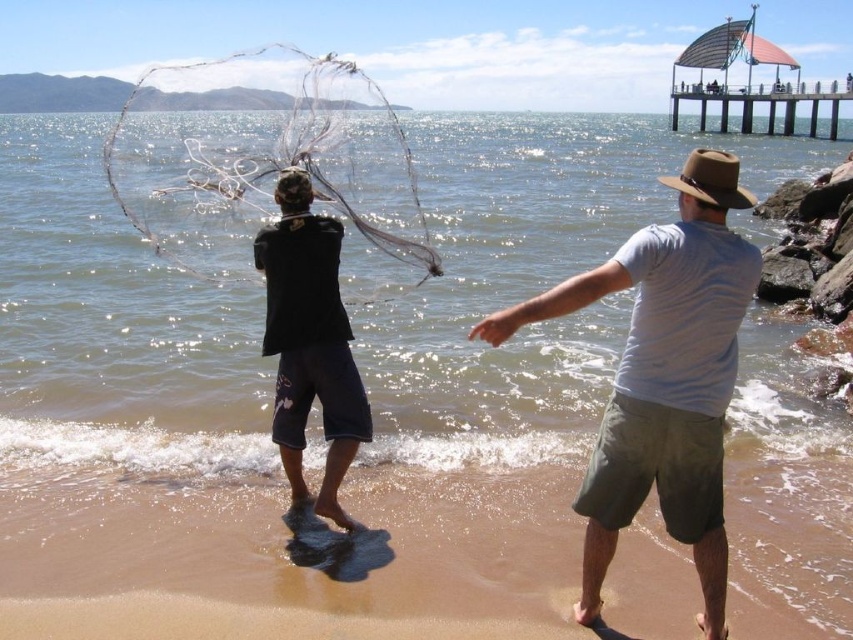
Question: Among these points, which one is farthest from the camera?

Choices:
 (A) (189, 192)
 (B) (287, 472)
 (C) (738, 163)

Answer: (A)

Question: Which of the following is the farthest from the observer?

Choices:
 (A) (32, 524)
 (B) (280, 380)

Answer: (B)

Question: Which is nearer to the wooden pier at upper right?

Choices:
 (A) brown sand at lower center
 (B) white cotton shirt at center
 (C) transparent nylon fishing net at center
 (D) black cotton shirt at center

Answer: (C)

Question: Is white cotton shirt at center above black cotton shirt at center?

Choices:
 (A) no
 (B) yes

Answer: (A)

Question: Is brown sand at lower center further to the viewer compared to transparent nylon fishing net at center?

Choices:
 (A) no
 (B) yes

Answer: (A)

Question: Where is white cotton shirt at center located in relation to wooden pier at upper right in the image?

Choices:
 (A) right
 (B) left

Answer: (B)